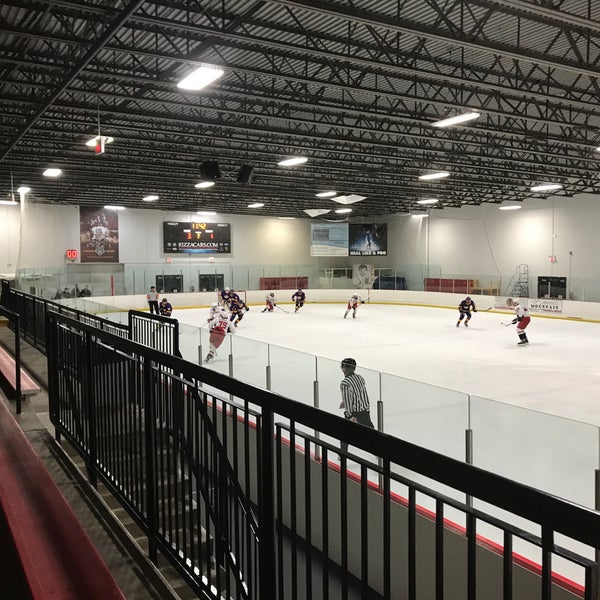
Identify the location of wall. click(522, 251).